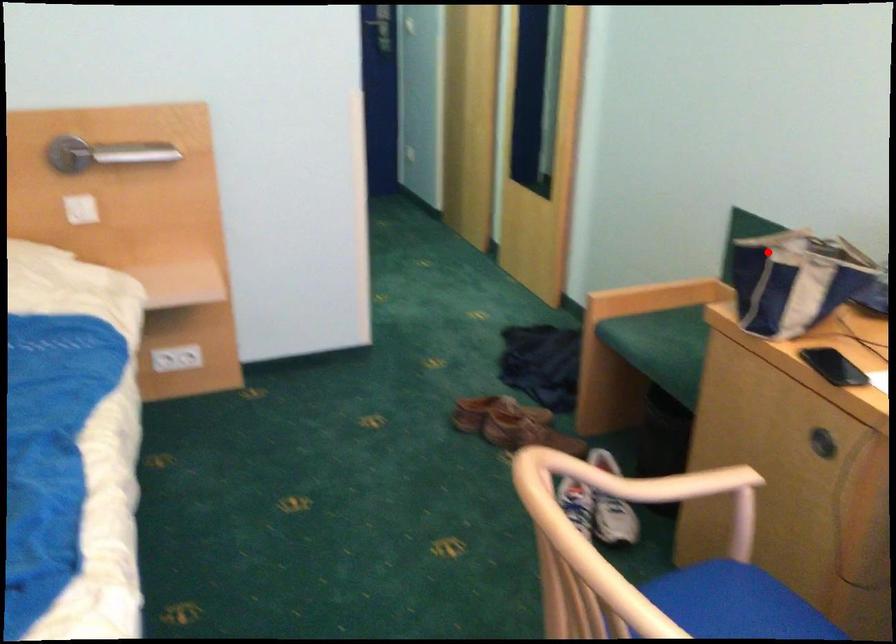
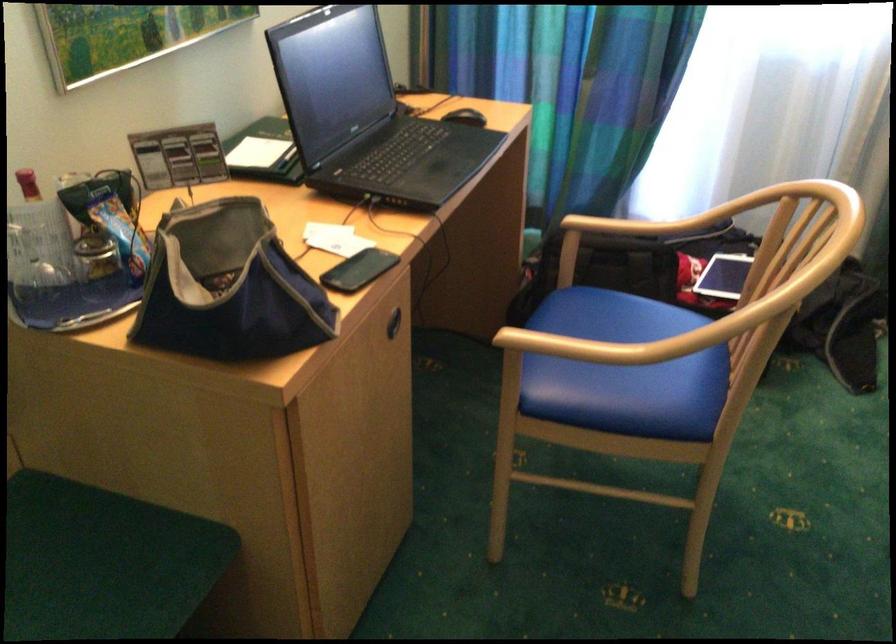
Where in the second image is the point corresponding to the highlighted location from the first image?

(228, 287)